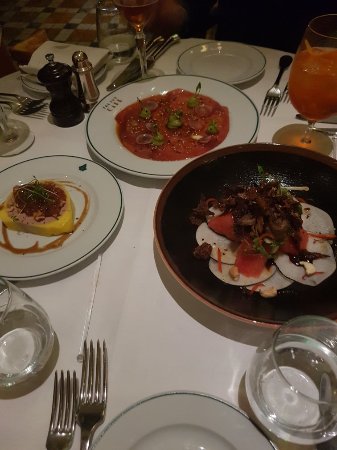
At what (x,y) coordinates should I click in order to perform the action: click on table. Please return your answer as a coordinate pair (x, y). Looking at the image, I should click on (175, 360).